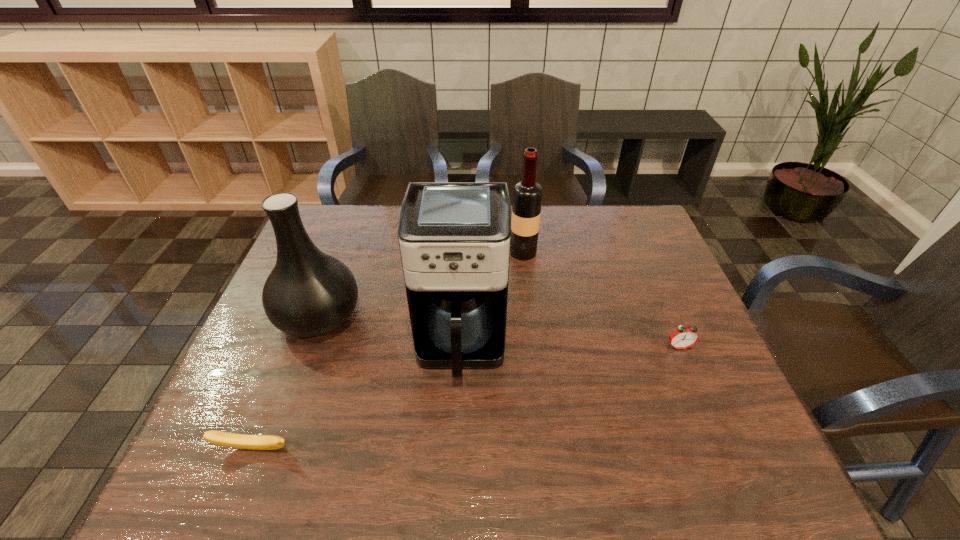
At what (x,y) coordinates should I click in order to perform the action: click on vacant space at the left edge of the desktop. Please return your answer as a coordinate pair (x, y). The width and height of the screenshot is (960, 540). Looking at the image, I should click on (251, 415).

I want to click on vacant region at the right edge of the desktop, so [691, 372].

In the image, there is a desktop. At what (x,y) coordinates should I click in order to perform the action: click on vacant space at the far left corner. Please return your answer as a coordinate pair (x, y). The height and width of the screenshot is (540, 960). Looking at the image, I should click on (338, 228).

Identify the location of vacant space at the far right corner of the desktop. (624, 212).

Find the location of a particular element. free space between the banana and the vase is located at coordinates (286, 382).

What are the coordinates of `empty space between the vase and the banana` in the screenshot? It's located at (286, 382).

Image resolution: width=960 pixels, height=540 pixels. In order to click on vacant area that lies between the shortest object and the alarm clock in this screenshot , I will do `click(467, 397)`.

Find the location of a particular element. Image resolution: width=960 pixels, height=540 pixels. free space that is in between the vase and the banana is located at coordinates (286, 382).

Where is `blank region between the wine bottle and the rightmost object`? blank region between the wine bottle and the rightmost object is located at coordinates [x=601, y=299].

Locate an element on the screen. The height and width of the screenshot is (540, 960). free space between the farthest object and the alarm clock is located at coordinates (601, 299).